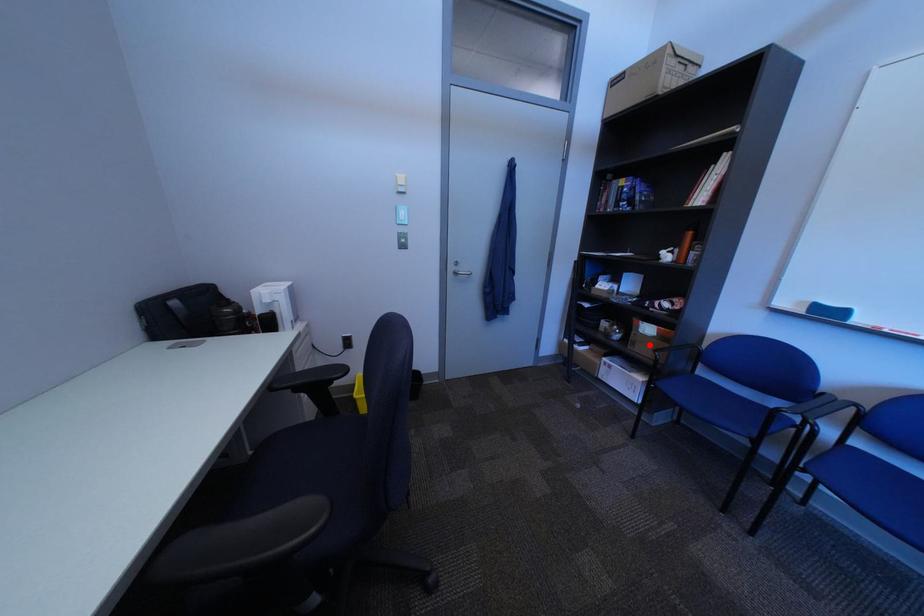
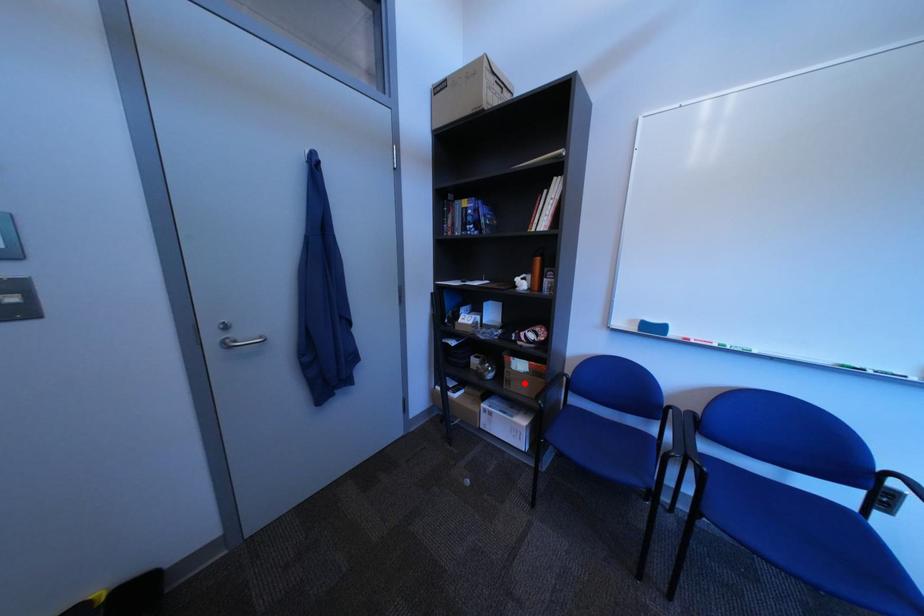
Consider the image. I am providing you with two images of the same scene from different viewpoints. A red point is marked on the first image and another point is marked on the second image. Is the marked point in image1 the same physical position as the marked point in image2?

Yes